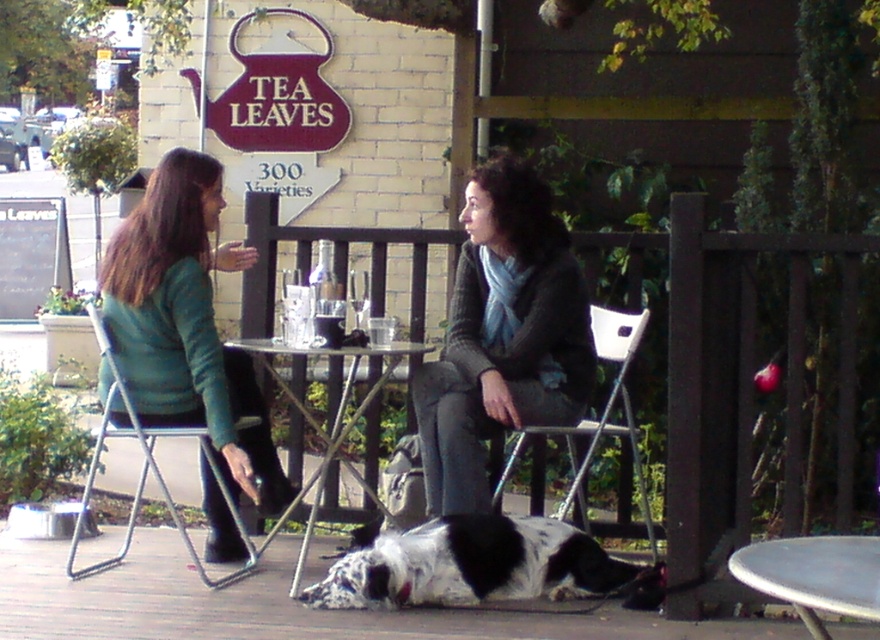
Can you confirm if teal sweater at left is positioned below metallic silver chair at left?

No, teal sweater at left is not below metallic silver chair at left.

Does teal sweater at left appear on the left side of metallic silver chair at left?

Incorrect, teal sweater at left is not on the left side of metallic silver chair at left.

This screenshot has height=640, width=880. What do you see at coordinates (186, 324) in the screenshot?
I see `teal sweater at left` at bounding box center [186, 324].

Find the location of a particular element. This screenshot has height=640, width=880. teal sweater at left is located at coordinates (186, 324).

Image resolution: width=880 pixels, height=640 pixels. I want to click on white plastic chair at center, so pyautogui.click(x=598, y=419).

Is white plastic chair at center bigger than metallic silver chair at left?

No.

In order to click on white plastic chair at center in this screenshot , I will do `click(598, 419)`.

Between black and white spotted dog at lower center and metallic silver table at lower right, which one has less height?

Standing shorter between the two is metallic silver table at lower right.

Does black and white spotted dog at lower center appear on the left side of metallic silver table at lower right?

Correct, you'll find black and white spotted dog at lower center to the left of metallic silver table at lower right.

Who is more forward, (547,518) or (737,561)?

Point (737,561) is more forward.

Locate an element on the screen. The width and height of the screenshot is (880, 640). black and white spotted dog at lower center is located at coordinates (481, 566).